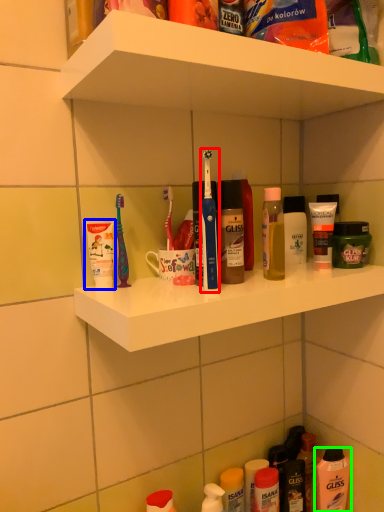
Question: Which object is the closest to the toothbrush (highlighted by a red box)? Choose among these: toiletry (highlighted by a blue box) or mouthwash (highlighted by a green box).

Choices:
 (A) toiletry
 (B) mouthwash

Answer: (A)